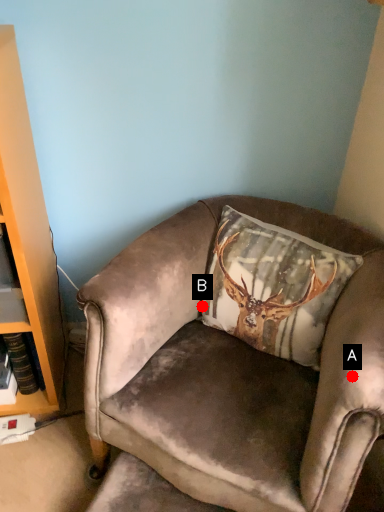
Question: Two points are circled on the image, labeled by A and B beside each circle. Among these points, which one is farthest from the camera?

Choices:
 (A) A is further
 (B) B is further

Answer: (B)